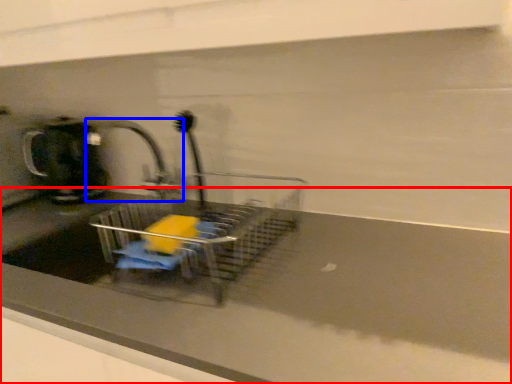
Question: Which point is further to the camera, counter top (highlighted by a red box) or tap (highlighted by a blue box)?

Choices:
 (A) counter top
 (B) tap

Answer: (B)